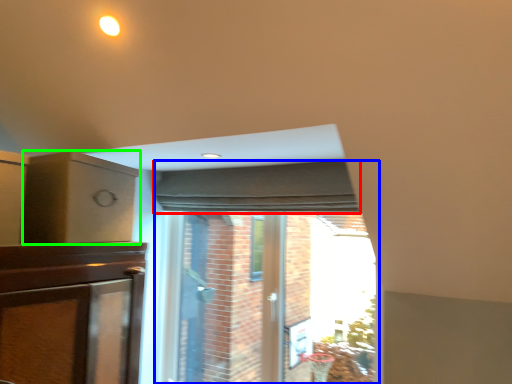
Question: Based on their relative distances, which object is nearer to curtain (highlighted by a red box)? Choose from bay window (highlighted by a blue box) and cabinetry (highlighted by a green box).

Choices:
 (A) bay window
 (B) cabinetry

Answer: (A)